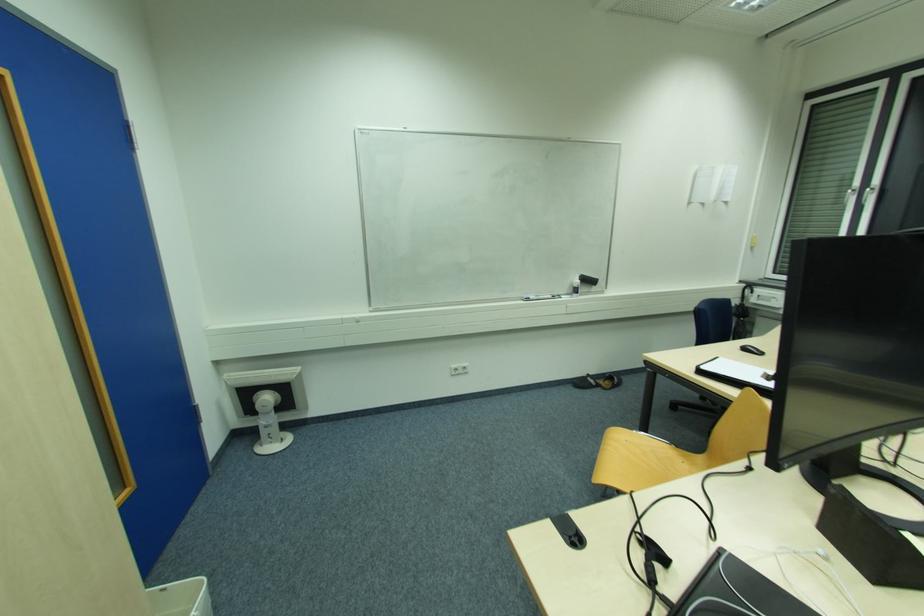
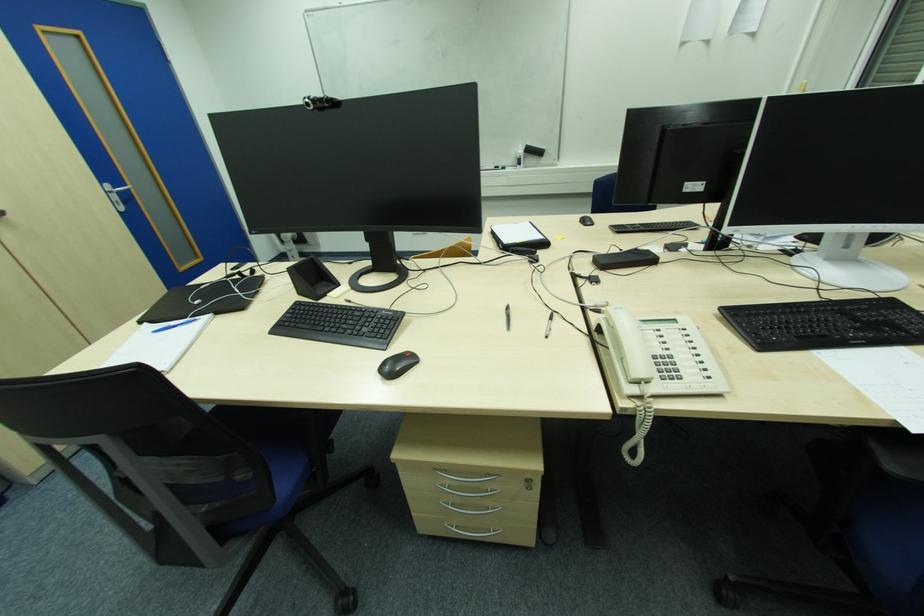
The point at (578, 282) is marked in the first image. Where is the corresponding point in the second image?

(521, 153)